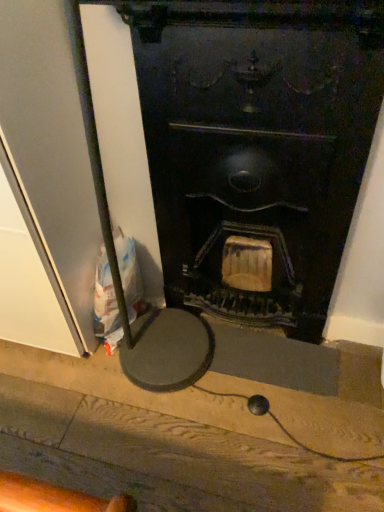
From the picture: Measure the distance between matte black wood burning stove at center and camera.

matte black wood burning stove at center and camera are 78.40 centimeters apart.

I want to click on matte black wood burning stove at center, so click(x=256, y=144).

What do you see at coordinates (256, 144) in the screenshot? I see `matte black wood burning stove at center` at bounding box center [256, 144].

You are a GUI agent. You are given a task and a screenshot of the screen. Output one action in this format:
    pyautogui.click(x=<x>, y=<y>)
    Task: Click on the matte black wood burning stove at center
    The image size is (384, 512).
    Given the screenshot: What is the action you would take?
    pyautogui.click(x=256, y=144)